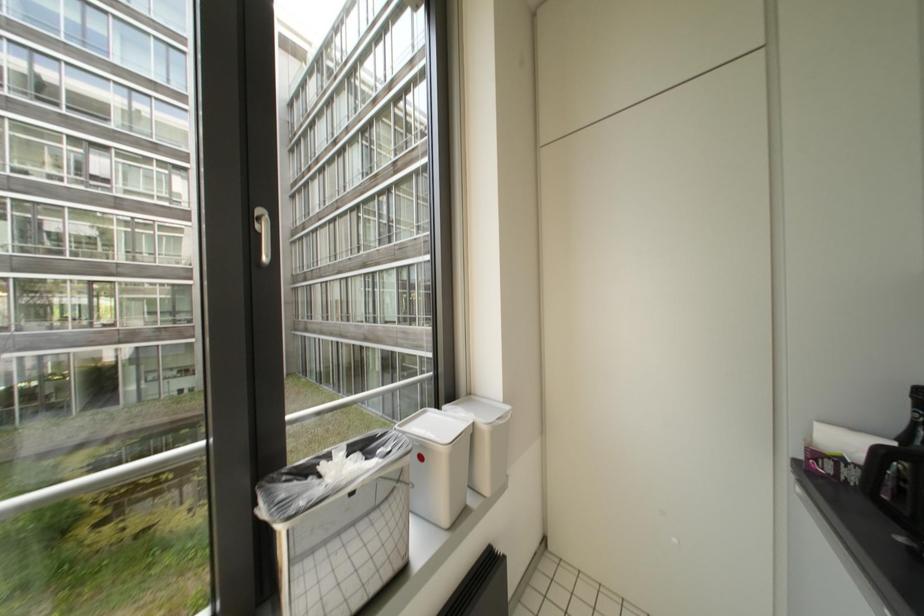
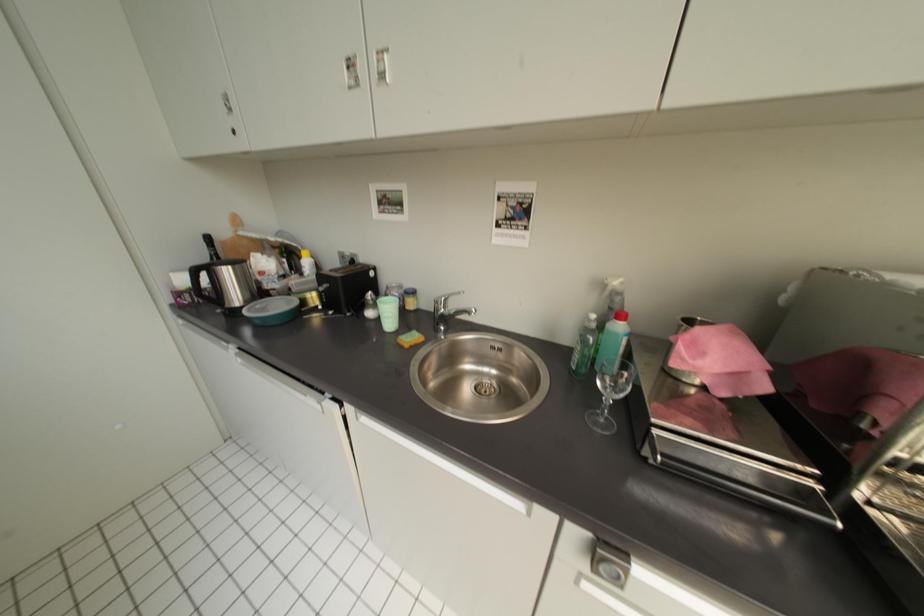
Looking at this image, how did the camera likely rotate?

The camera rotated toward right-down.